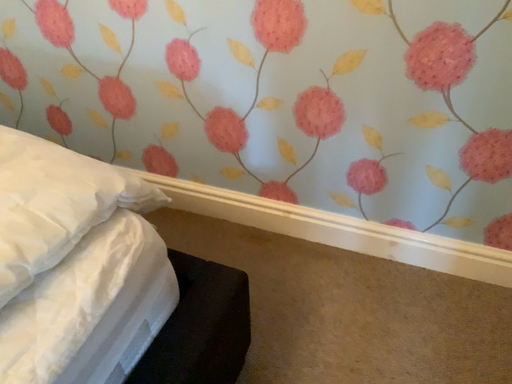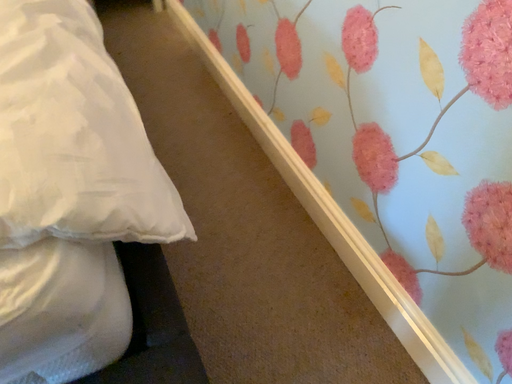
Question: How did the camera likely rotate when shooting the video?

Choices:
 (A) rotated right
 (B) rotated left

Answer: (B)